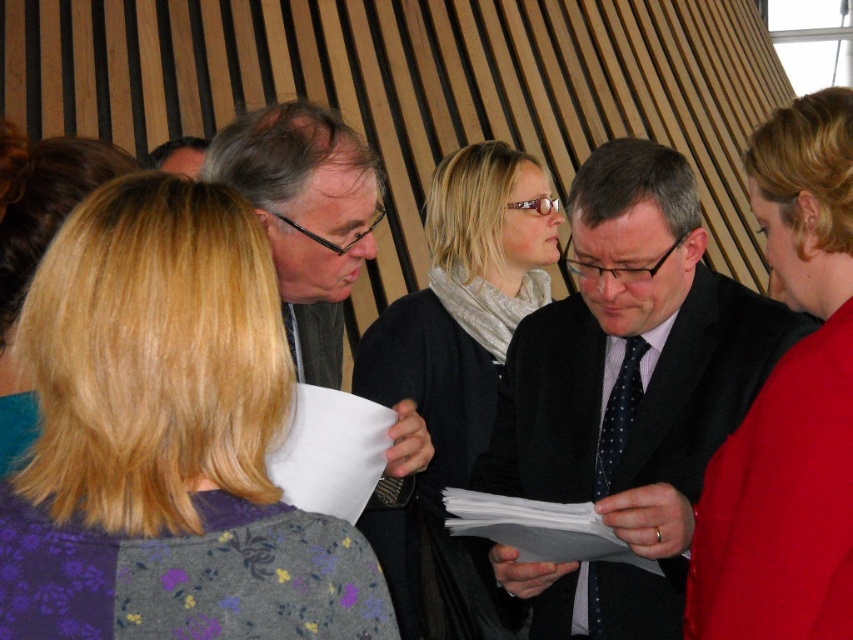
Question: Which object is positioned closest to the matte black glasses at center?

Choices:
 (A) matte red sweater at center
 (B) matte black suit at center

Answer: (B)

Question: Does blonde hair at center appear on the right side of matte black glasses at center?

Choices:
 (A) no
 (B) yes

Answer: (A)

Question: Is blonde hair at center above matte black suit at center?

Choices:
 (A) yes
 (B) no

Answer: (A)

Question: Is matte black suit at center below matte red sweater at center?

Choices:
 (A) yes
 (B) no

Answer: (A)

Question: Estimate the real-world distances between objects in this image. Which object is farther from the blonde hair at center?

Choices:
 (A) silver metallic scarf at center
 (B) matte red sweater at center
 (C) matte black suit at center
 (D) matte black glasses at center

Answer: (A)

Question: Which object is the closest to the dark blue dotted tie at center?

Choices:
 (A) silver metallic scarf at center
 (B) matte black glasses at center
 (C) matte black suit at center
 (D) matte red sweater at center

Answer: (C)